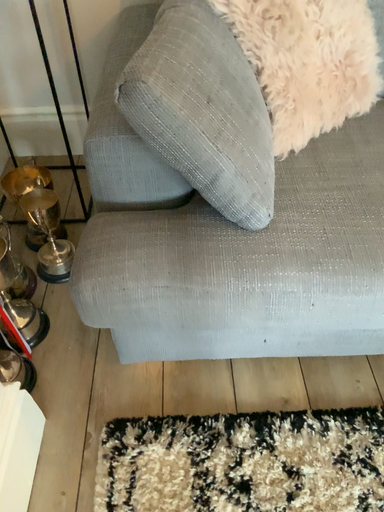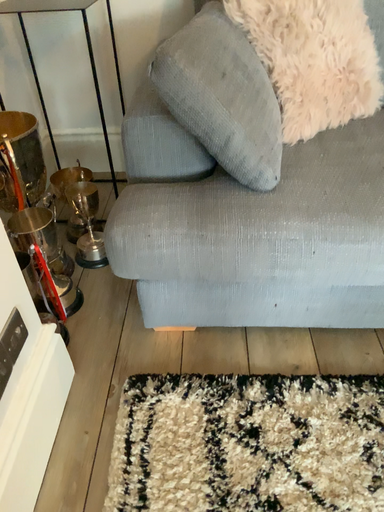
Question: Which way did the camera rotate in the video?

Choices:
 (A) rotated downward
 (B) rotated upward

Answer: (B)